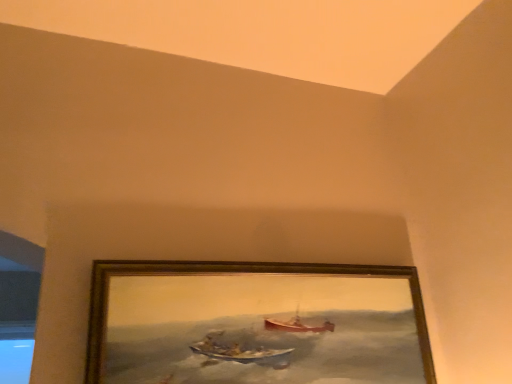
Question: Should I look upward or downward to see wooden frame at center?

Choices:
 (A) up
 (B) down

Answer: (B)